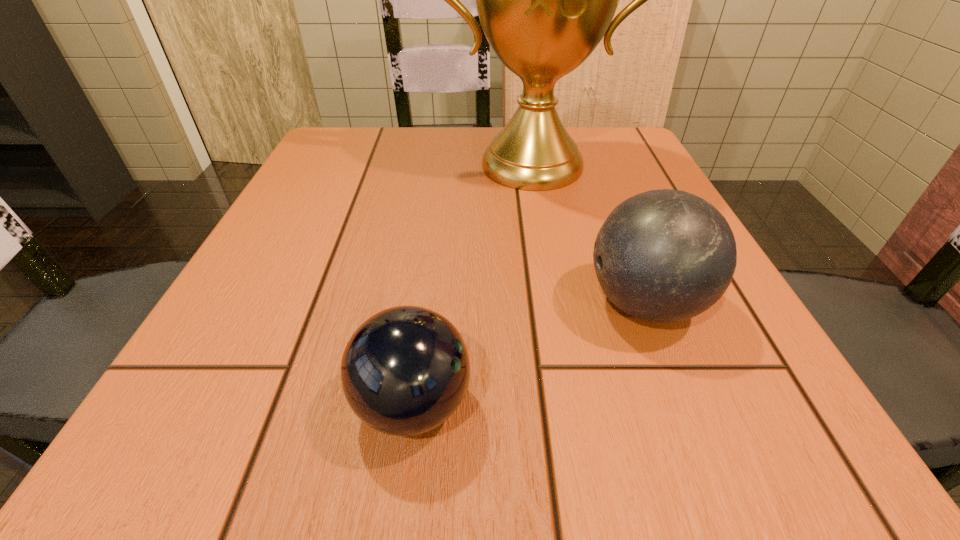
Locate an element on the screen. blank space at the far left corner is located at coordinates (317, 156).

Where is `vacant space at the near left corner of the desktop`? This screenshot has width=960, height=540. vacant space at the near left corner of the desktop is located at coordinates (187, 413).

Locate an element on the screen. The width and height of the screenshot is (960, 540). free region at the far right corner of the desktop is located at coordinates (579, 138).

Identify the location of vacant space at the near right corner of the desktop. (806, 449).

This screenshot has height=540, width=960. What are the coordinates of `empty space between the farthest object and the right bowling ball` in the screenshot? It's located at (588, 234).

In order to click on free space between the right bowling ball and the shorter bowling ball in this screenshot , I will do `click(529, 354)`.

Where is `vacant space that is in between the farthest object and the taller bowling ball`? vacant space that is in between the farthest object and the taller bowling ball is located at coordinates (588, 234).

This screenshot has width=960, height=540. Find the location of `free point between the tallest object and the second farthest object`. free point between the tallest object and the second farthest object is located at coordinates (588, 234).

Find the location of a particular element. vacant region between the tallest object and the taller bowling ball is located at coordinates (588, 234).

Locate an element on the screen. The image size is (960, 540). free space between the shorter bowling ball and the farthest object is located at coordinates (472, 285).